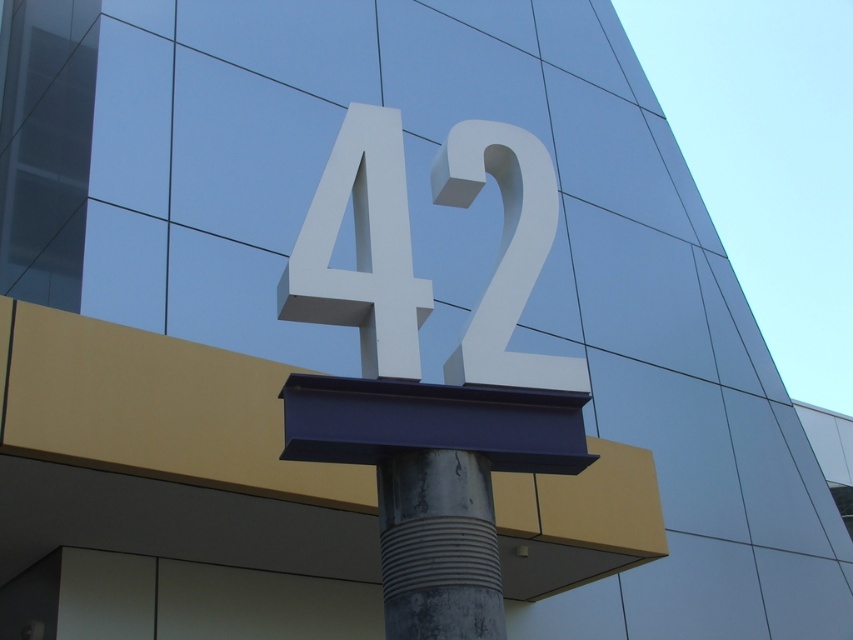
Who is more forward, (402, 259) or (451, 490)?

Point (451, 490) is in front.

The width and height of the screenshot is (853, 640). In order to click on white matte number at center in this screenshot , I will do `click(361, 248)`.

Can you confirm if white matte number at center is taller than white glossy number at center?

Yes.

Measure the distance between point (315, 243) and camera.

Point (315, 243) and camera are 3.72 meters apart.

Find the location of a particular element. The height and width of the screenshot is (640, 853). white matte number at center is located at coordinates (361, 248).

Is rusty metallic pole at center closer to camera compared to white glossy number at center?

That is True.

Measure the distance between rusty metallic pole at center and camera.

rusty metallic pole at center is 11.01 feet away from camera.

Image resolution: width=853 pixels, height=640 pixels. What are the coordinates of `rusty metallic pole at center` in the screenshot? It's located at (438, 547).